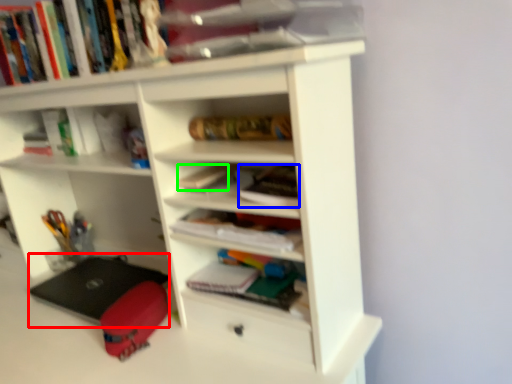
Question: Estimate the real-world distances between objects in this image. Which object is farther from laptop (highlighted by a red box), book (highlighted by a blue box) or book (highlighted by a green box)?

Choices:
 (A) book
 (B) book

Answer: (A)